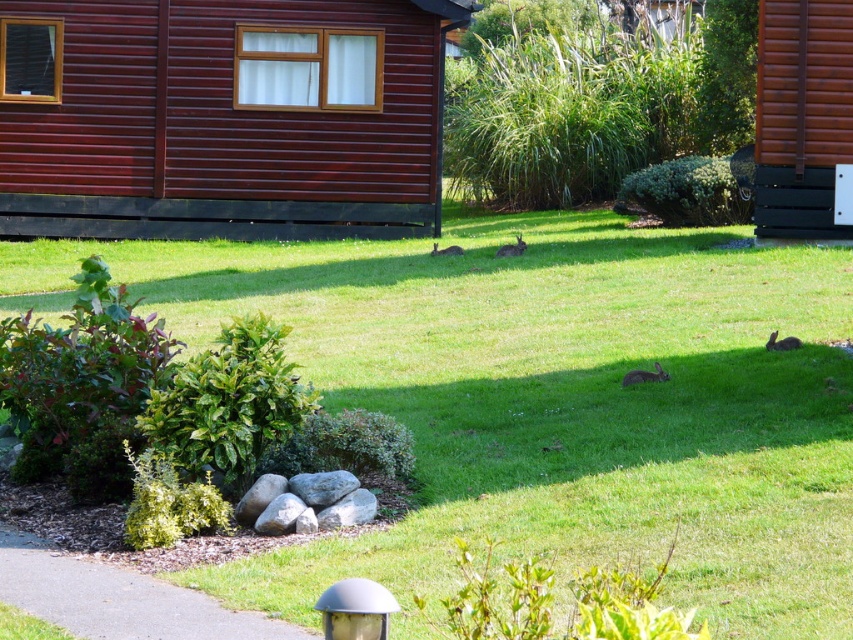
Question: Which object appears closest to the camera in this image?

Choices:
 (A) wooden cabin at upper left
 (B) green grass at center

Answer: (B)

Question: Which object is positioned farthest from the green grass at center?

Choices:
 (A) brown wooden cabin at right
 (B) wooden cabin at upper left

Answer: (B)

Question: Does green grass at center lie in front of wooden cabin at upper left?

Choices:
 (A) no
 (B) yes

Answer: (B)

Question: Is green grass at center smaller than brown wooden cabin at right?

Choices:
 (A) no
 (B) yes

Answer: (A)

Question: Estimate the real-world distances between objects in this image. Which object is farther from the brown wooden cabin at right?

Choices:
 (A) wooden cabin at upper left
 (B) green grass at center

Answer: (A)

Question: Can you confirm if green grass at center is smaller than wooden cabin at upper left?

Choices:
 (A) yes
 (B) no

Answer: (B)